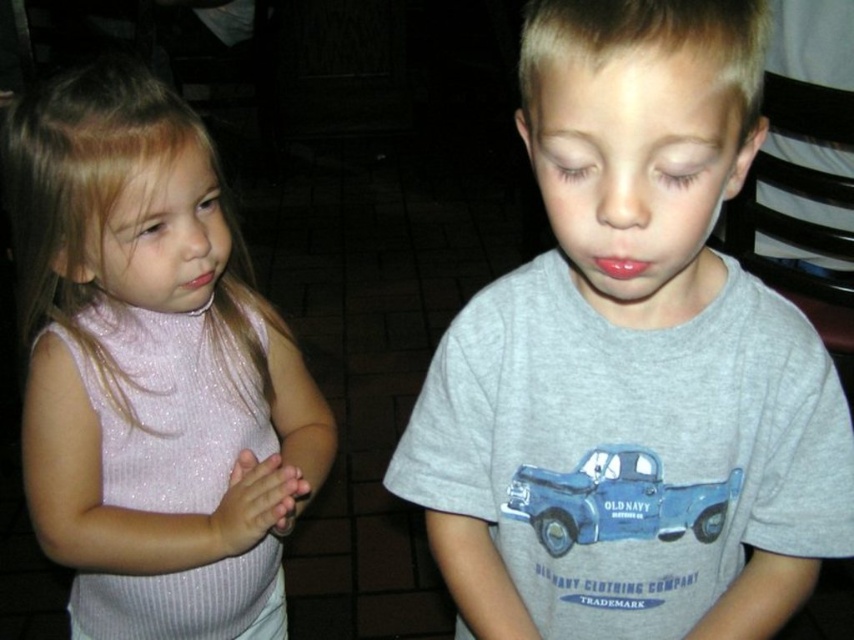
Between gray cotton shirt at center and pink glittery dress at left, which one has more height?

pink glittery dress at left

Is gray cotton shirt at center to the right of pink glittery dress at left from the viewer's perspective?

Indeed, gray cotton shirt at center is positioned on the right side of pink glittery dress at left.

This screenshot has width=854, height=640. I want to click on gray cotton shirt at center, so click(x=632, y=362).

Measure the distance from gray cotton shirt at center to blue matte truck at center.

gray cotton shirt at center is 10.05 centimeters away from blue matte truck at center.

Is point (443, 541) more distant than point (554, 548)?

Yes, point (443, 541) is farther from viewer.

This screenshot has height=640, width=854. I want to click on gray cotton shirt at center, so click(x=632, y=362).

You are a GUI agent. You are given a task and a screenshot of the screen. Output one action in this format:
    pyautogui.click(x=<x>, y=<y>)
    Task: Click on the gray cotton shirt at center
    This screenshot has height=640, width=854.
    Given the screenshot: What is the action you would take?
    pyautogui.click(x=632, y=362)

I want to click on pink glittery dress at left, so click(x=151, y=369).

Is pink glittery dress at left to the left of blue matte truck at center from the viewer's perspective?

Yes, pink glittery dress at left is to the left of blue matte truck at center.

Which is behind, point (133, 280) or point (562, 540)?

The point (133, 280) is behind.

The width and height of the screenshot is (854, 640). I want to click on pink glittery dress at left, so click(151, 369).